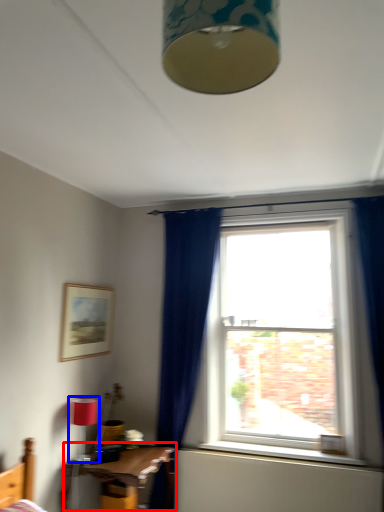
Question: Among these objects, which one is nearest to the camera, table (highlighted by a red box) or light fixture (highlighted by a blue box)?

Choices:
 (A) table
 (B) light fixture

Answer: (A)